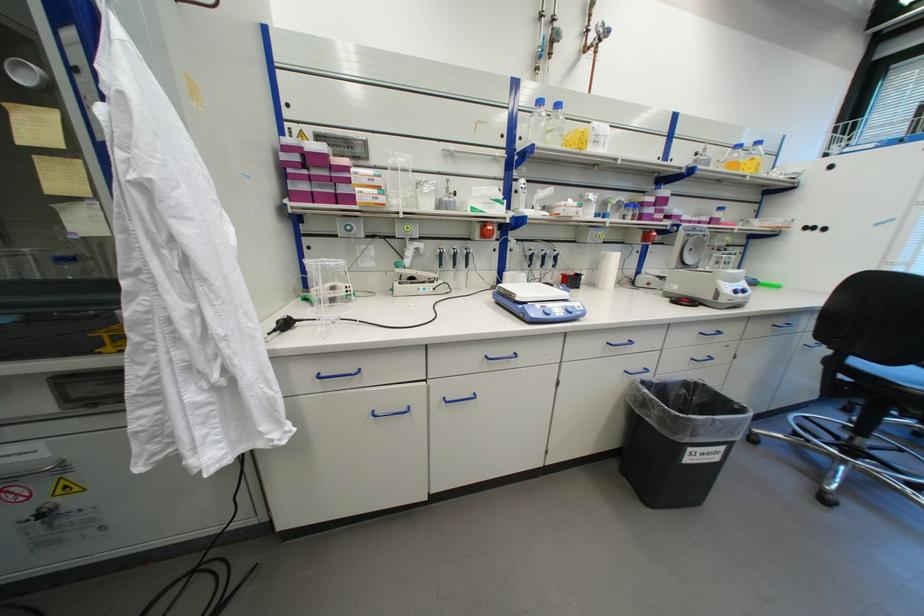
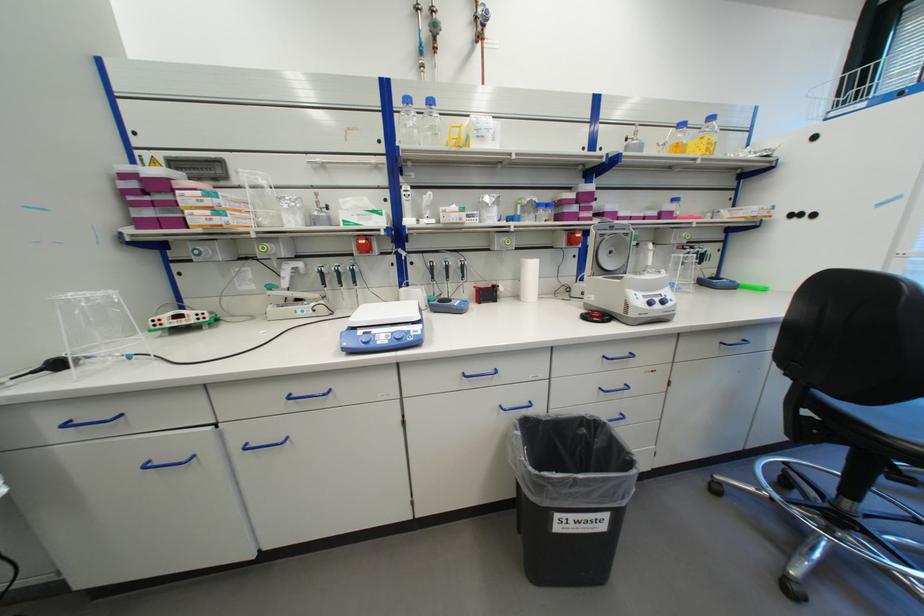
Question: I am providing you with two images of the same scene from different viewpoints. After the viewpoint changes to image2, which objects are now occluded?

Choices:
 (A) centrifuge lid
 (B) pipette plunger
 (C) chair sitting surface
 (D) none of these

Answer: (D)